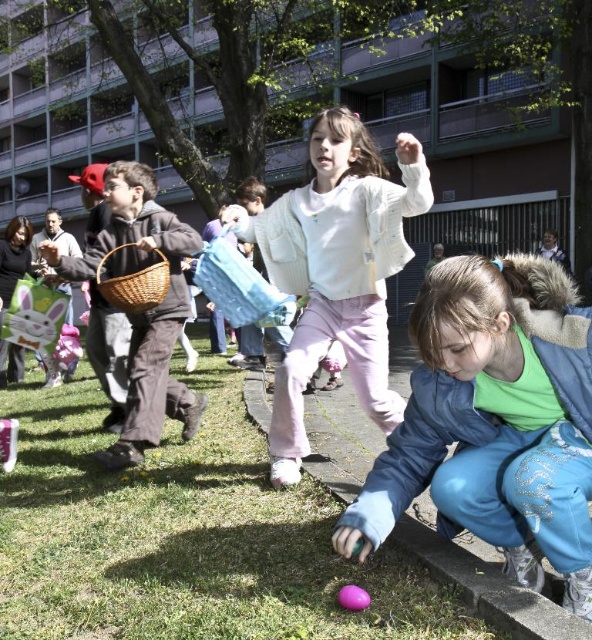
Does green fleece jacket at lower right appear under matte brown wicker basket at left?

Yes, green fleece jacket at lower right is below matte brown wicker basket at left.

Who is shorter, green fleece jacket at lower right or matte brown wicker basket at left?

green fleece jacket at lower right is shorter.

Which is behind, point (429, 307) or point (178, 332)?

Positioned behind is point (178, 332).

You are a GUI agent. You are given a task and a screenshot of the screen. Output one action in this format:
    pyautogui.click(x=<x>, y=<y>)
    Task: Click on the green fleece jacket at lower right
    The height and width of the screenshot is (640, 592).
    Given the screenshot: What is the action you would take?
    [494, 420]

In the scene shown: Can you confirm if green fleece jacket at lower right is taller than white fuzzy sweater at center?

Incorrect, green fleece jacket at lower right's height is not larger of white fuzzy sweater at center's.

Measure the distance between green fleece jacket at lower right and white fuzzy sweater at center.

green fleece jacket at lower right and white fuzzy sweater at center are 1.02 meters apart.

Where is `green fleece jacket at lower right`? green fleece jacket at lower right is located at coordinates (494, 420).

Measure the distance between point (56,477) and camera.

They are 3.54 meters apart.

Which is in front, point (140, 570) or point (578, 344)?

Point (578, 344)

The height and width of the screenshot is (640, 592). What do you see at coordinates (184, 536) in the screenshot? I see `green grass at lower left` at bounding box center [184, 536].

Find the location of a particular element. The height and width of the screenshot is (640, 592). green grass at lower left is located at coordinates (184, 536).